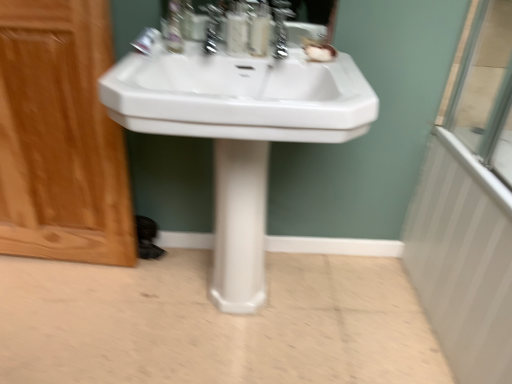
Question: From the image's perspective, would you say translucent plastic soap dispenser at center, positioned as the 1th soap dispenser in left-to-right order, is positioned over white textured radiator at right?

Choices:
 (A) no
 (B) yes

Answer: (B)

Question: Are translucent plastic soap dispenser at center, positioned as the second soap dispenser in right-to-left order, and white textured radiator at right far apart?

Choices:
 (A) no
 (B) yes

Answer: (A)

Question: Can you confirm if translucent plastic soap dispenser at center, positioned as the 1th soap dispenser in left-to-right order, is thinner than white textured radiator at right?

Choices:
 (A) no
 (B) yes

Answer: (A)

Question: Is translucent plastic soap dispenser at center, positioned as the 1th soap dispenser in left-to-right order, closer to the viewer compared to white textured radiator at right?

Choices:
 (A) no
 (B) yes

Answer: (A)

Question: Considering the relative positions of translucent plastic soap dispenser at center, positioned as the second soap dispenser in right-to-left order, and white textured radiator at right in the image provided, is translucent plastic soap dispenser at center, positioned as the second soap dispenser in right-to-left order, to the right of white textured radiator at right from the viewer's perspective?

Choices:
 (A) no
 (B) yes

Answer: (A)

Question: Would you say satin nickel faucet at upper center, which is the first faucet in right-to-left order, is to the left or to the right of wooden screen door at left in the picture?

Choices:
 (A) right
 (B) left

Answer: (A)

Question: Considering the positions of satin nickel faucet at upper center, which is the first faucet in right-to-left order, and wooden screen door at left in the image, is satin nickel faucet at upper center, which is the first faucet in right-to-left order, wider or thinner than wooden screen door at left?

Choices:
 (A) thin
 (B) wide

Answer: (B)

Question: Relative to wooden screen door at left, is satin nickel faucet at upper center, which is the 2th faucet in left-to-right order, in front or behind?

Choices:
 (A) behind
 (B) front

Answer: (A)

Question: Based on their sizes in the image, would you say satin nickel faucet at upper center, which is the 2th faucet in left-to-right order, is bigger or smaller than wooden screen door at left?

Choices:
 (A) small
 (B) big

Answer: (A)

Question: In the image, is white textured radiator at right on the left side or the right side of satin nickel faucet at upper center, which is the 2th faucet in left-to-right order?

Choices:
 (A) left
 (B) right

Answer: (B)

Question: From a real-world perspective, relative to satin nickel faucet at upper center, which is the first faucet in right-to-left order, is white textured radiator at right vertically above or below?

Choices:
 (A) below
 (B) above

Answer: (A)

Question: Is white textured radiator at right wider or thinner than satin nickel faucet at upper center, which is the first faucet in right-to-left order?

Choices:
 (A) wide
 (B) thin

Answer: (B)

Question: Considering the positions of point (421, 208) and point (280, 34), is point (421, 208) closer or farther from the camera than point (280, 34)?

Choices:
 (A) closer
 (B) farther

Answer: (B)

Question: Considering the relative positions of clear plastic bottle at upper center and white glossy sink at center in the image provided, is clear plastic bottle at upper center to the left or to the right of white glossy sink at center?

Choices:
 (A) left
 (B) right

Answer: (A)

Question: From the image's perspective, relative to white glossy sink at center, is clear plastic bottle at upper center above or below?

Choices:
 (A) above
 (B) below

Answer: (A)